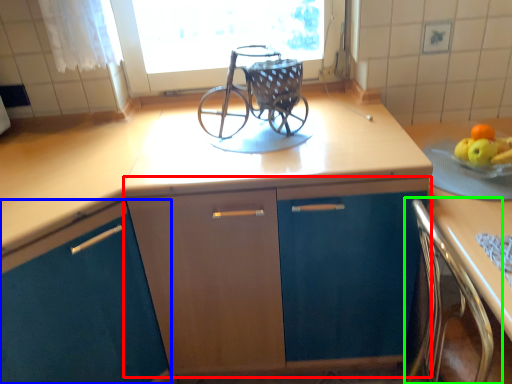
Question: Considering the real-world distances, which object is closest to cabinetry (highlighted by a red box)? cabinetry (highlighted by a blue box) or chair (highlighted by a green box).

Choices:
 (A) cabinetry
 (B) chair

Answer: (A)